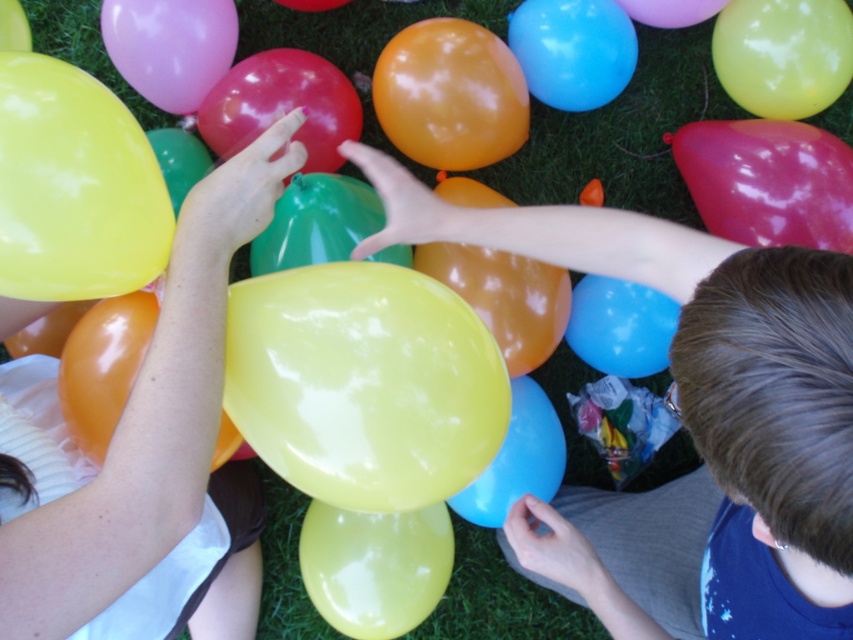
You are a photographer trying to capture a clear photo of the yellow glossy balloon at upper left without the glossy orange balloon at center blocking it. Can you adjust your position to do so?

The yellow glossy balloon at upper left is in front of the glossy orange balloon at center, so you cannot adjust your position to avoid the glossy orange balloon at center blocking it.

You are standing in the middle of the grassy area and see both the smooth yellow balloon at center and the glossy orange balloon at center. Which balloon is nearer to you?

The smooth yellow balloon at center is closer to the viewer than the glossy orange balloon at center, so the smooth yellow balloon at center is nearer to you.

You are a photographer trying to capture a clear shot of both the smooth yellow balloon at upper left and the yellow glossy balloon at upper left. Since you want to focus on the taller one, which balloon should you aim your camera at?

The smooth yellow balloon at upper left is taller than the yellow glossy balloon at upper left, so you should aim your camera at the smooth yellow balloon at upper left to focus on the taller one.